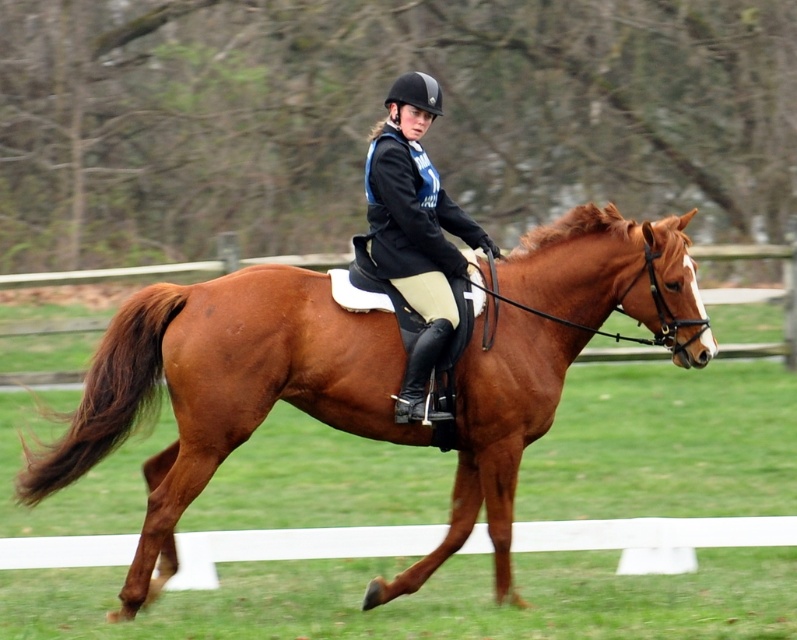
Question: Which of the following is the closest to the observer?

Choices:
 (A) (422, 280)
 (B) (241, 324)

Answer: (B)

Question: Is brown glossy horse at center in front of matte black helmet at center?

Choices:
 (A) yes
 (B) no

Answer: (A)

Question: Is brown glossy horse at center to the left of matte black helmet at center from the viewer's perspective?

Choices:
 (A) yes
 (B) no

Answer: (A)

Question: Which point is farther to the camera?

Choices:
 (A) brown glossy horse at center
 (B) matte black helmet at center

Answer: (B)

Question: Is brown glossy horse at center bigger than matte black helmet at center?

Choices:
 (A) no
 (B) yes

Answer: (B)